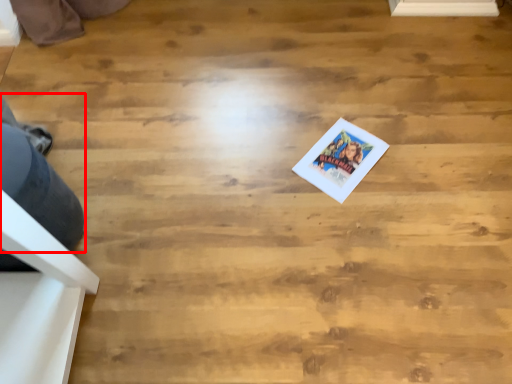
Question: From the image's perspective, what is the correct spatial relationship of person (annotated by the red box) in relation to postcard?

Choices:
 (A) below
 (B) above

Answer: (A)